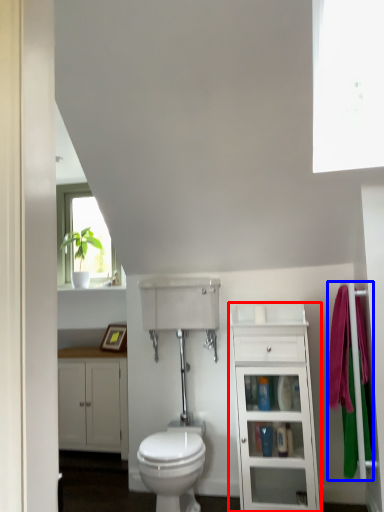
Question: Which of the following is the farthest to the observer, bathroom cabinet (highlighted by a red box) or bath towel (highlighted by a blue box)?

Choices:
 (A) bathroom cabinet
 (B) bath towel

Answer: (A)